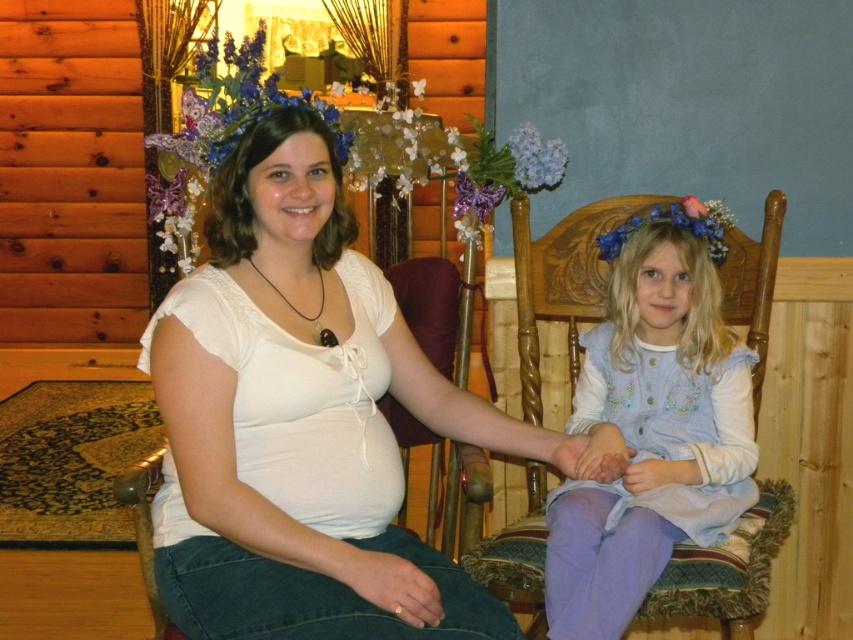
Question: Does white lace shirt at center come behind light blue fabric dress at center?

Choices:
 (A) yes
 (B) no

Answer: (B)

Question: Which object is closer to the camera taking this photo?

Choices:
 (A) white lace shirt at center
 (B) light blue fabric dress at center

Answer: (A)

Question: Does white lace shirt at center appear on the right side of light blue fabric dress at center?

Choices:
 (A) yes
 (B) no

Answer: (B)

Question: Does white lace shirt at center appear under light blue fabric dress at center?

Choices:
 (A) no
 (B) yes

Answer: (A)

Question: Which point is farther to the camera?

Choices:
 (A) [x=241, y=262]
 (B) [x=619, y=476]

Answer: (B)